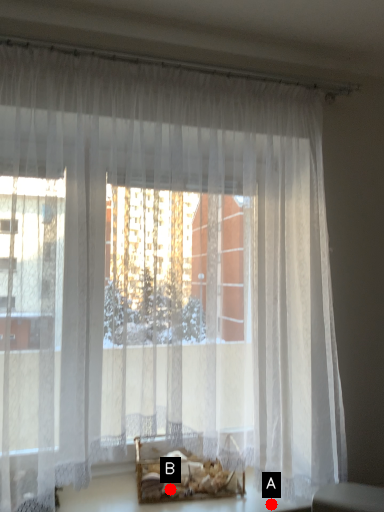
Question: Two points are circled on the image, labeled by A and B beside each circle. Among these points, which one is nearest to the camera?

Choices:
 (A) A is closer
 (B) B is closer

Answer: (A)